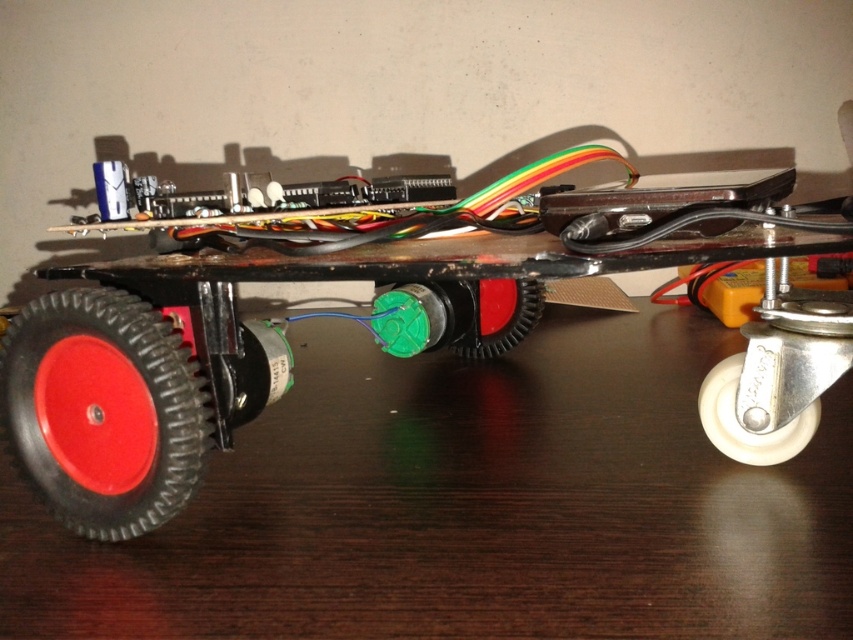
Does point (141, 497) come in front of point (99, 323)?

No, it is not.

In the scene shown: Is rubberized black toy car at center shorter than rubber/textured wheel at lower left?

In fact, rubberized black toy car at center may be taller than rubber/textured wheel at lower left.

Is point (485, 204) in front of point (96, 513)?

No, (485, 204) is further to viewer.

The width and height of the screenshot is (853, 640). Identify the location of rubberized black toy car at center. (373, 314).

Based on the photo, between white rubber wheel at lower right and green rubber wheel at center, which one has more height?

green rubber wheel at center

Is white rubber wheel at lower right positioned behind green rubber wheel at center?

No.

Locate an element on the screen. Image resolution: width=853 pixels, height=640 pixels. white rubber wheel at lower right is located at coordinates (743, 426).

Is point (549, 236) closer to camera compared to point (468, 355)?

Yes, point (549, 236) is in front of point (468, 355).

Is point (308, 221) farther from viewer compared to point (492, 321)?

No.

Where is `rubberized black toy car at center`? rubberized black toy car at center is located at coordinates (373, 314).

What are the coordinates of `rubberized black toy car at center` in the screenshot? It's located at (373, 314).